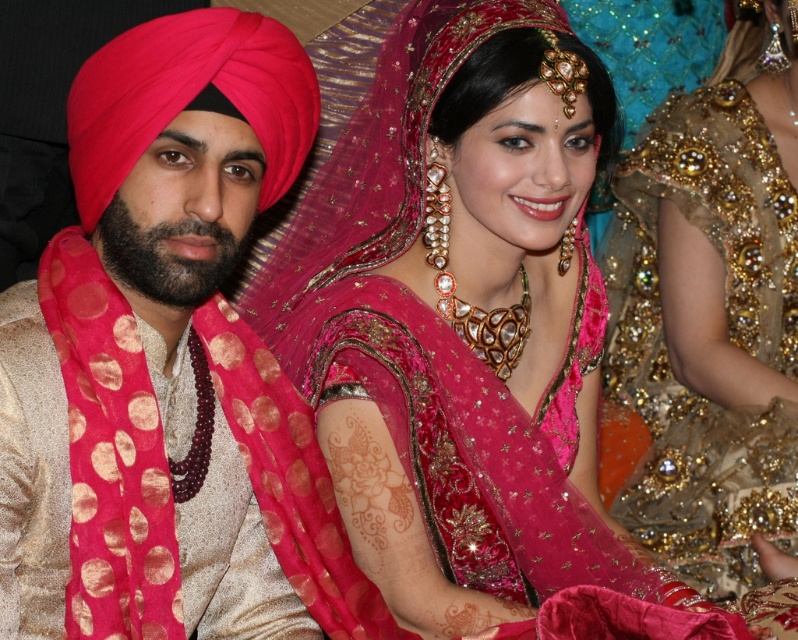
You are a photographer at a wedding event. You need to decide whether the matte pink fabric at center can fully cover the gold sequined lehenga at right if placed over it. Can it?

The matte pink fabric at center might be wider than gold sequined lehenga at right, so there is a possibility that it could cover it depending on the exact dimensions.

In the scene shown: You are standing at a distance of 10 feet from the couple in the image. There is a point at coordinates point (547, 634) that you want to reach. Can you walk directly to this point without moving closer than 8 feet to the couple?

The distance of point (547, 634) from viewer is 8.15 feet. Since 8.15 feet is greater than 8 feet, you can walk directly to point (547, 634) without moving closer than 8 feet to the couple.

You are a photographer at a wedding event and need to adjust the lighting to ensure both the matte pink fabric at center and the matte pink turban at left are well illuminated. Considering their sizes, which object requires a wider light spread to capture its full height?

The matte pink fabric at center is much taller than the matte pink turban at left, so the wider light spread should be directed towards the matte pink fabric at center to fully illuminate its height.